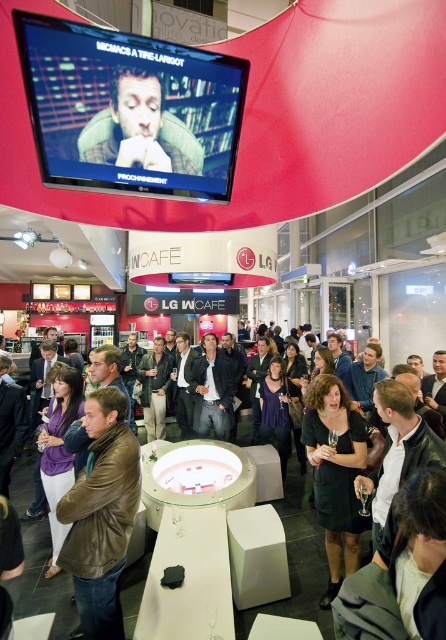
Does point (63, 556) come closer to viewer compared to point (355, 499)?

Yes.

Who is more forward, (118, 396) or (342, 480)?

Point (118, 396) is more forward.

Is point (99, 465) closer to viewer compared to point (310, 396)?

That is True.

In order to click on brown leather jacket at lower left in this screenshot , I will do `click(102, 515)`.

Is point (351, 500) positioned before point (165, 161)?

No, it is behind (165, 161).

Is black satin dress at center further to camera compared to matte black face at upper center?

Yes.

What do you see at coordinates (334, 474) in the screenshot? Image resolution: width=446 pixels, height=640 pixels. I see `black satin dress at center` at bounding box center [334, 474].

Where is `black satin dress at center`? This screenshot has width=446, height=640. black satin dress at center is located at coordinates (334, 474).

How much distance is there between brown leather jacket at lower left and matte black face at upper center?

brown leather jacket at lower left and matte black face at upper center are 5.12 feet apart.

What do you see at coordinates (102, 515) in the screenshot? I see `brown leather jacket at lower left` at bounding box center [102, 515].

Locate an element on the screen. This screenshot has height=640, width=446. brown leather jacket at lower left is located at coordinates (102, 515).